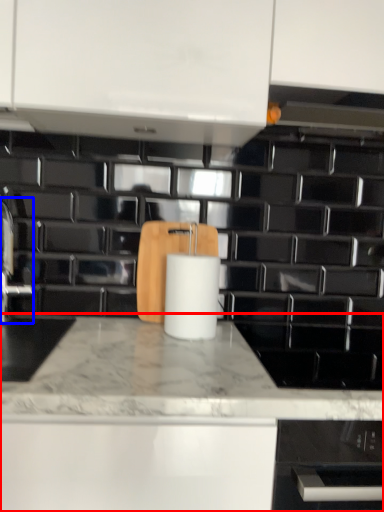
Question: Which point is closer to the camera, countertop (highlighted by a red box) or faucet (highlighted by a blue box)?

Choices:
 (A) countertop
 (B) faucet

Answer: (A)